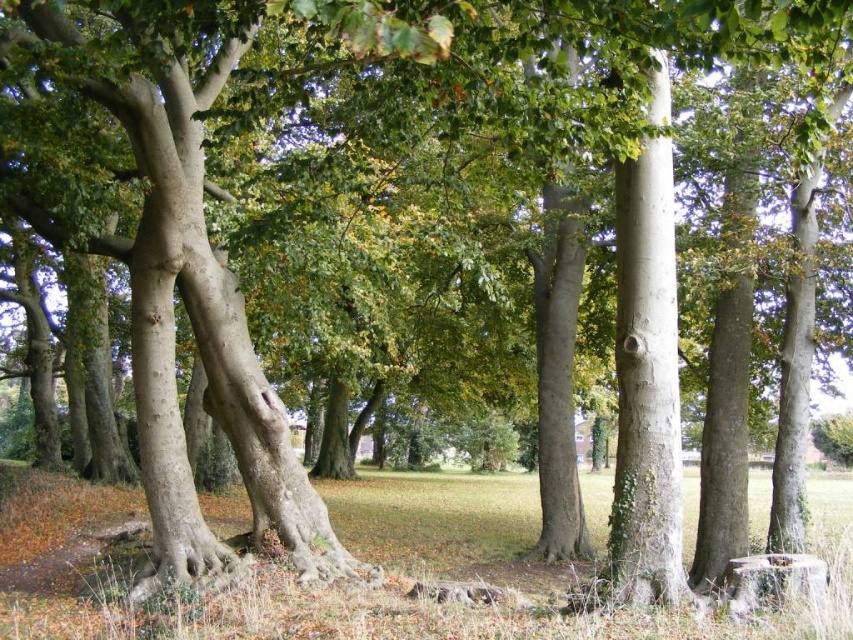
Who is taller, green grass at lower center or smooth gray tree trunk at center?

smooth gray tree trunk at center

Does point (273, 573) come in front of point (662, 230)?

No, it is not.

The height and width of the screenshot is (640, 853). I want to click on green grass at lower center, so click(x=390, y=572).